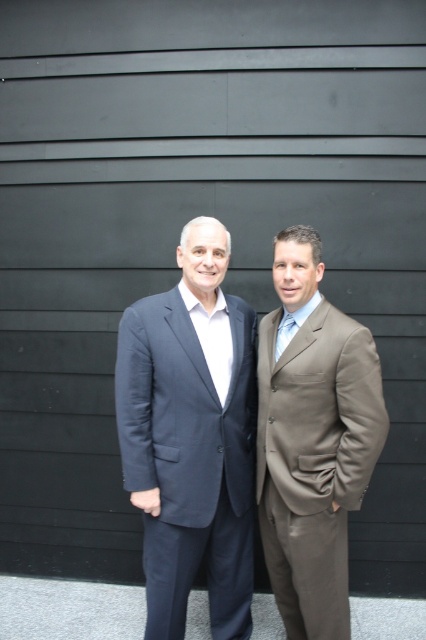
Does matte blue suit at center have a lesser width compared to matte brown suit at right?

In fact, matte blue suit at center might be wider than matte brown suit at right.

Is matte blue suit at center to the left of matte brown suit at right from the viewer's perspective?

Correct, you'll find matte blue suit at center to the left of matte brown suit at right.

Between point (219, 368) and point (308, 525), which one is positioned behind?

Positioned behind is point (219, 368).

Where is `matte blue suit at center`? The width and height of the screenshot is (426, 640). matte blue suit at center is located at coordinates (190, 436).

Is point (290, 540) positioned after point (276, 358)?

No, (290, 540) is in front of (276, 358).

Between matte brown suit at right and light blue silk tie at center, which one is positioned higher?

light blue silk tie at center is higher up.

Measure the distance between point (281, 481) and camera.

Point (281, 481) and camera are 7.43 feet apart.

Find the location of `matte brown suit at right`. matte brown suit at right is located at coordinates (313, 442).

Between matte blue suit at center and light blue silk tie at center, which one appears on the left side from the viewer's perspective?

matte blue suit at center

Who is shorter, matte blue suit at center or light blue silk tie at center?

With less height is light blue silk tie at center.

Identify the location of matte blue suit at center. Image resolution: width=426 pixels, height=640 pixels. (190, 436).